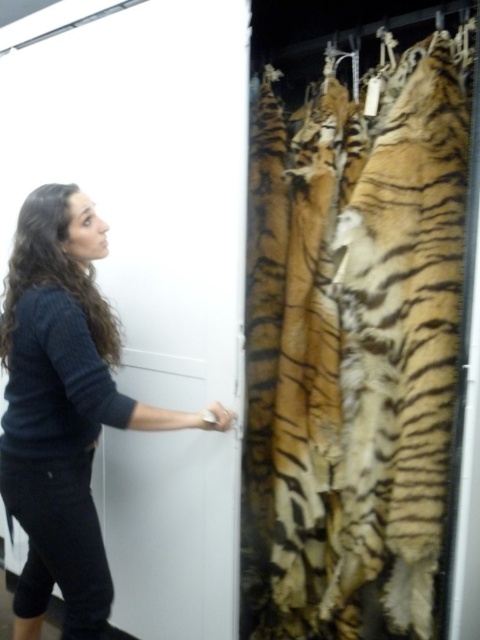
Question: Is orange-brown fur tiger at right wider than dark blue sweater at center?

Choices:
 (A) no
 (B) yes

Answer: (A)

Question: Does orange-brown fur tiger at right appear on the left side of dark blue sweater at center?

Choices:
 (A) yes
 (B) no

Answer: (B)

Question: Can you confirm if orange-brown fur tiger at right is positioned below dark blue sweater at center?

Choices:
 (A) no
 (B) yes

Answer: (A)